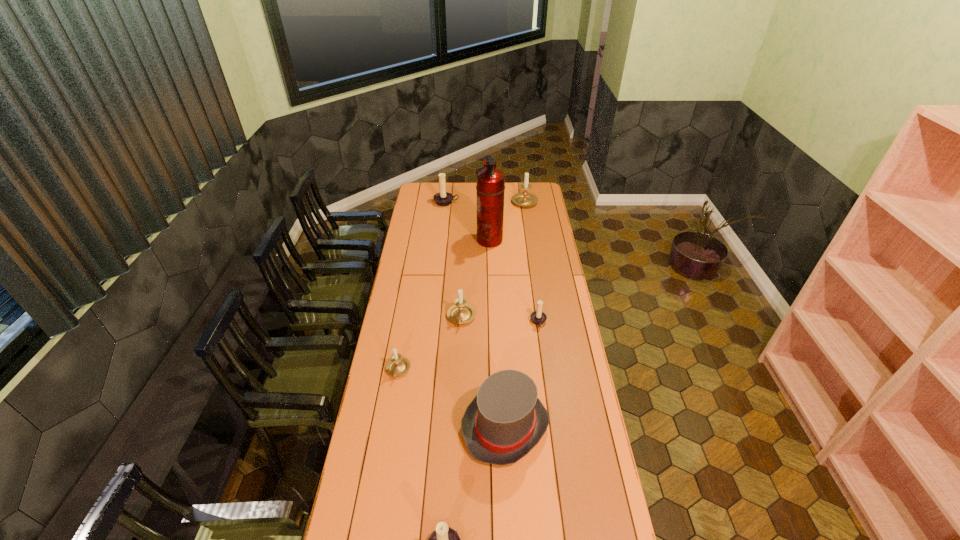
In order to click on vacant space positioned 0.270m with a handle on the side of the leftmost beige candle holder in this screenshot , I will do `click(385, 446)`.

The width and height of the screenshot is (960, 540). Identify the location of vacant space located 0.190m on the wick of the second nearest brown candle holder. (489, 322).

Find the location of `vacant area situated 0.220m on the wick of the second nearest brown candle holder`. vacant area situated 0.220m on the wick of the second nearest brown candle holder is located at coordinates (482, 322).

Locate an element on the screen. The height and width of the screenshot is (540, 960). free space located on the wick of the second nearest brown candle holder is located at coordinates (489, 322).

The width and height of the screenshot is (960, 540). Identify the location of object at the far left corner. (443, 198).

At what (x,y) coordinates should I click in order to perform the action: click on object that is at the far right corner. Please return your answer as a coordinate pair (x, y). This screenshot has width=960, height=540. Looking at the image, I should click on (524, 198).

In the image, there is a desktop. In order to click on vacant space at the left edge in this screenshot , I will do `click(392, 458)`.

Locate an element on the screen. The width and height of the screenshot is (960, 540). free space at the right edge is located at coordinates (563, 305).

I want to click on empty space that is in between the fire extinguisher and the second smallest beige candle holder, so click(475, 279).

What are the coordinates of `free space between the rightmost beige candle holder and the tallest object` in the screenshot? It's located at (507, 220).